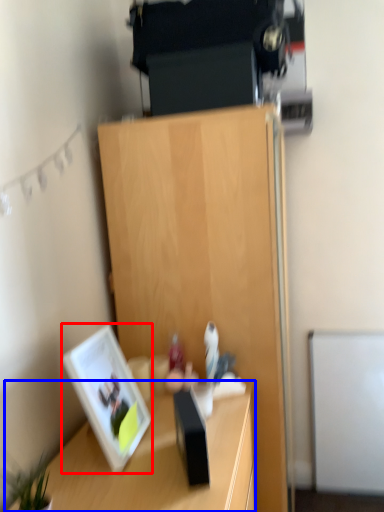
Question: Which object is closer to the camera taking this photo, picture frame (highlighted by a red box) or desk (highlighted by a blue box)?

Choices:
 (A) picture frame
 (B) desk

Answer: (B)